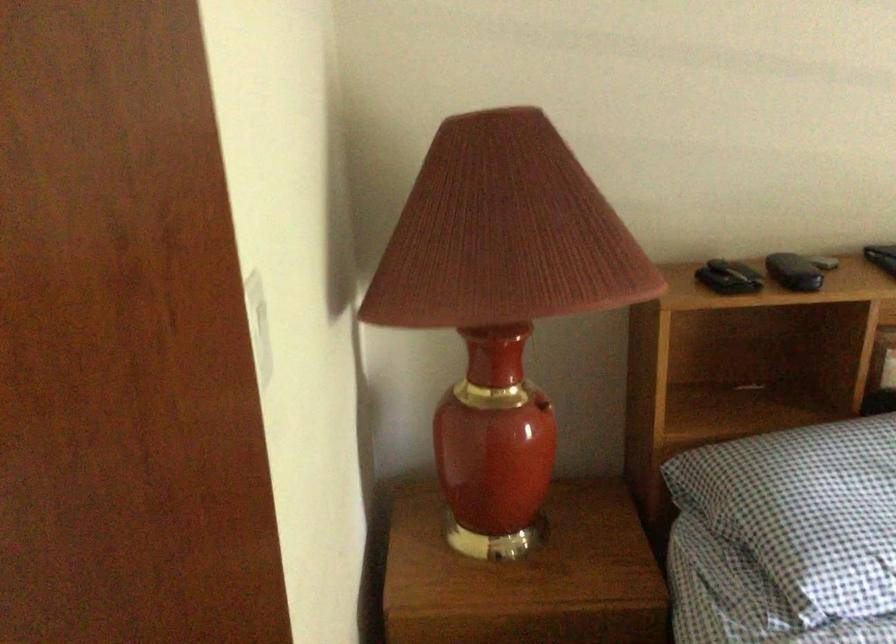
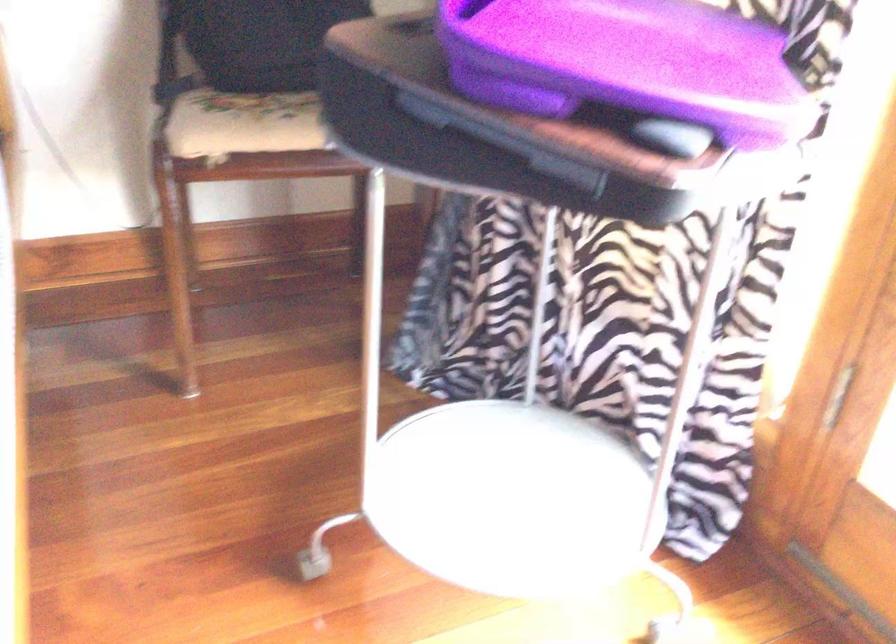
Question: Which direction would the cameraman need to move to produce the second image? Reply with the corresponding letter.

Choices:
 (A) Left
 (B) Right
 (C) Forward
 (D) Backward

Answer: (B)